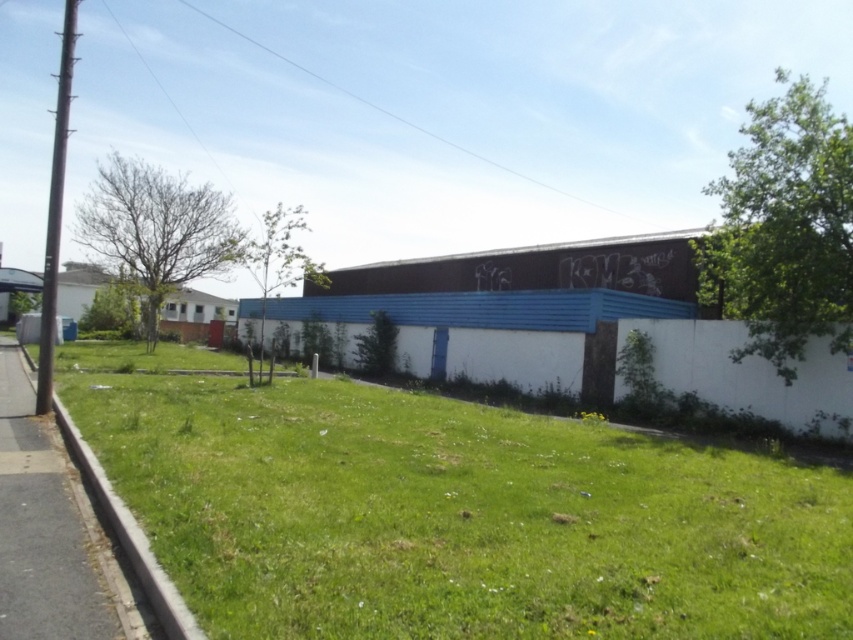
Can you confirm if green grassy at lower left is bigger than gray asphalt pavement at lower left?

Correct, green grassy at lower left is larger in size than gray asphalt pavement at lower left.

Who is positioned more to the left, green grassy at lower left or gray asphalt pavement at lower left?

Positioned to the left is gray asphalt pavement at lower left.

Locate an element on the screen. The height and width of the screenshot is (640, 853). green grassy at lower left is located at coordinates (457, 515).